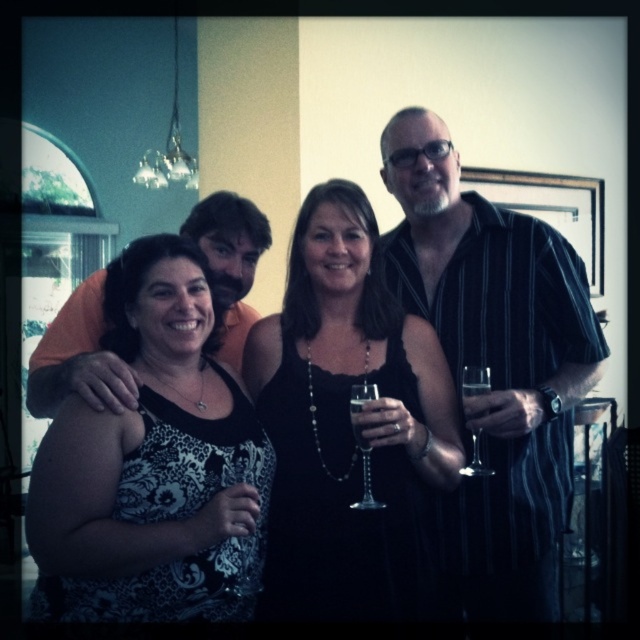
What do you see at coordinates (154, 465) in the screenshot? I see `black lace dress at left` at bounding box center [154, 465].

Which of these two, black lace dress at left or orangematerialshirt at left, stands taller?

With more height is black lace dress at left.

This screenshot has width=640, height=640. What do you see at coordinates (154, 465) in the screenshot?
I see `black lace dress at left` at bounding box center [154, 465].

Find the location of a particular element. Image resolution: width=640 pixels, height=640 pixels. black lace dress at left is located at coordinates (154, 465).

Does black lace dress at left appear on the right side of clear glass wine at right?

No, black lace dress at left is not to the right of clear glass wine at right.

Is black lace dress at left below clear glass wine at right?

Indeed, black lace dress at left is positioned under clear glass wine at right.

Which is in front, point (182, 426) or point (474, 410)?

Point (182, 426) is more forward.

The image size is (640, 640). Identify the location of black lace dress at left. click(x=154, y=465).

Is clear glass wine glass at right wider than clear glass wine at right?

Yes.

Is clear glass wine glass at right positioned at the back of clear glass wine at right?

No, it is in front of clear glass wine at right.

This screenshot has height=640, width=640. I want to click on clear glass wine glass at right, so click(x=476, y=380).